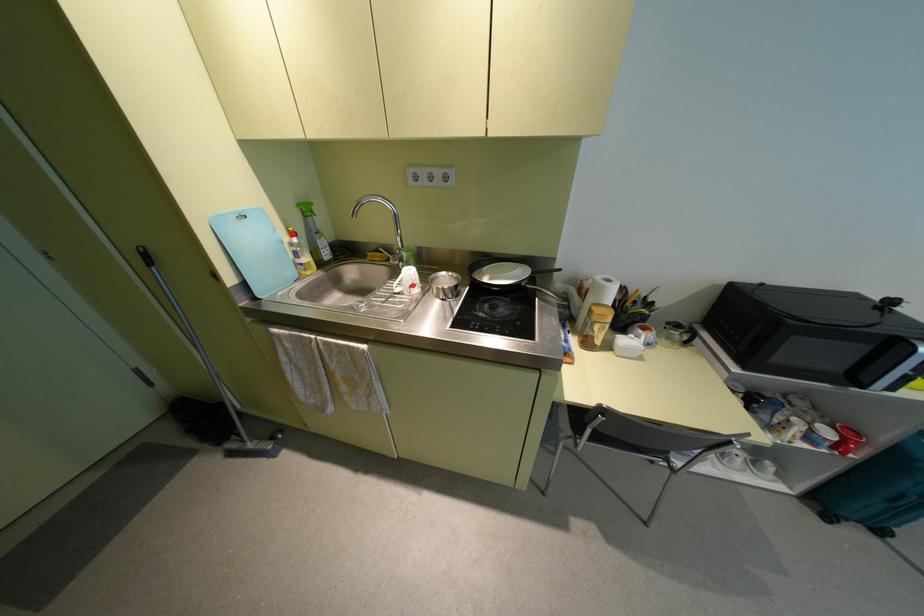
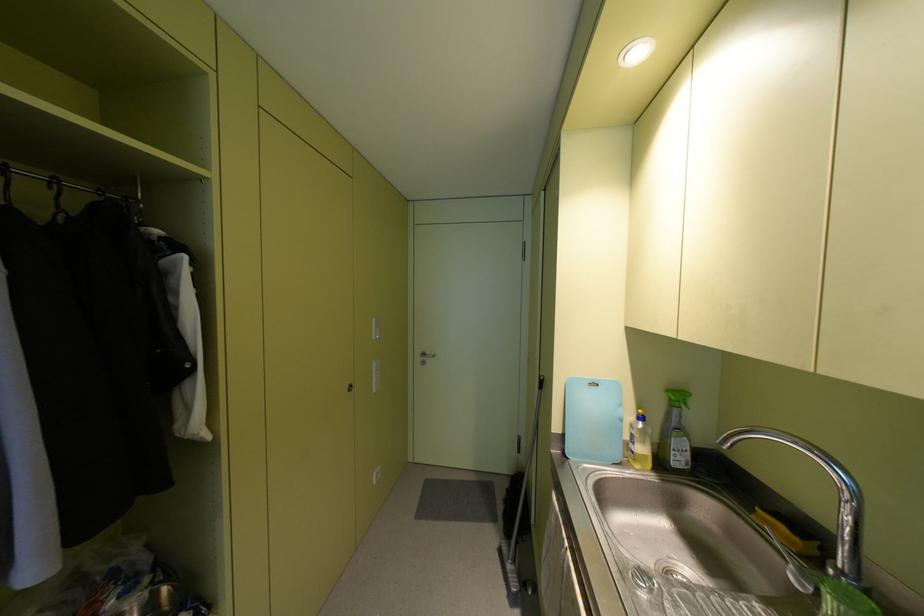
Where in the second image is the point corresponding to the highlighted location from the first image?

(640, 416)